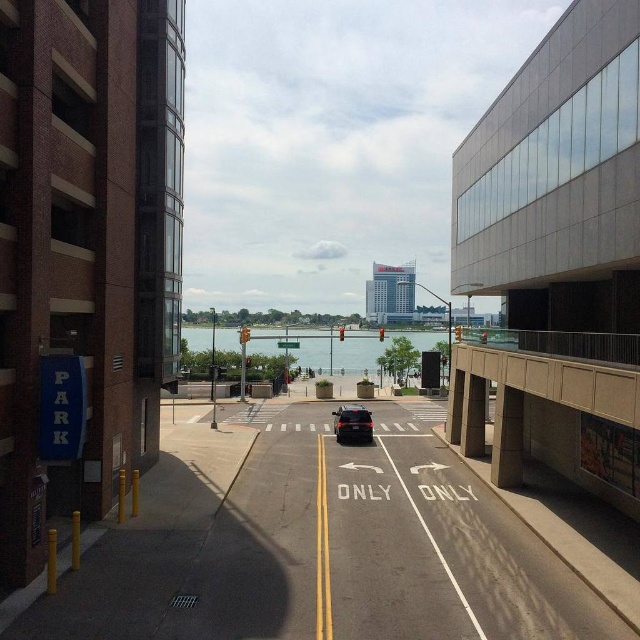
You are a delivery driver who needs to park your truck in the brick parking garage at left. However, your truck is 2 meters tall. Can you safely enter the garage if the shiny black sedan at center is parked directly in front of the entrance?

The brick parking garage at left is above the shiny black sedan at center, which means the garage entrance is elevated. Since the sedan is parked below, it doesn not block the entrance. Therefore, you can safely enter the garage with your 2 meter tall truck as long as the height clearance is sufficient.

You are a delivery driver who needs to park your vehicle in the gray concrete parking garage at right. Based on the image, what is the best path to take from your current position at the point marked by coordinates point (557, 180)?

The best path to the gray concrete parking garage at right would be to follow the road towards the parking structure, staying on the left side of the road as indicated by the double yellow line, and proceed to the entrance near the blue

Consider the image. You are standing at the parking structure and want to walk towards the water. There are two points marked on the road ahead of you at coordinates point (x=532, y=413) and point (x=532, y=417). Which point should you aim for if you want to reach the water faster?

Point (x=532, y=413) is closer to the viewer than point (x=532, y=417). Since you want to reach the water faster, you should aim for point (x=532, y=413) as it is nearer to your current position at the parking structure.